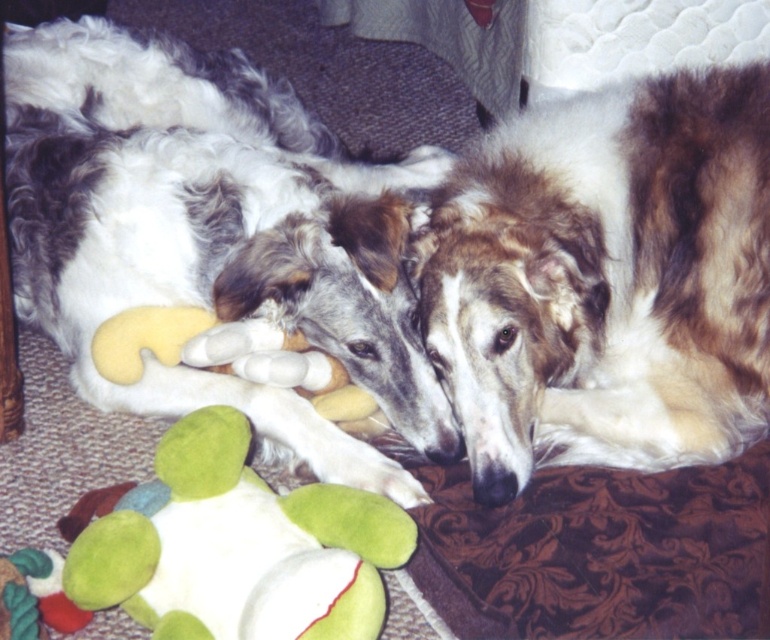
You are a dog owner who wants to place a new dog bed for the soft plush dog at center and the brown shaggy dog at center. Since both dogs like to lie close to each other, where should you place the new bed relative to the existing one to maintain their usual positions?

The soft plush dog at center is positioned on the left side of the brown shaggy dog at center, so the new bed should be placed to the left of the existing bed to maintain their usual positions.

You are a dog owner who wants to place a new water bowl between the soft plush dog at center and the brown shaggy dog at center. If the bowl has a diameter of 12 inches, will it fit in the space between them without overlapping either dog?

The soft plush dog at center and brown shaggy dog at center are 14.02 inches apart from each other. The water bowl with a 12 inch diameter requires at least 12 inches of space. Since 14.02 inches is greater than 12 inches, the bowl will fit between them without overlapping either dog.

You are holding a camera that is 1.6 meters tall. You want to take a photo of the brown shaggy dog at center without bending down. Is the camera height suitable for capturing the dog at eye level?

The brown shaggy dog at center and camera are 1.43 meters apart from each other. Since the camera is 1.6 meters tall, it is slightly higher than the dog, so you can take the photo without bending down and still capture the dog at eye level.